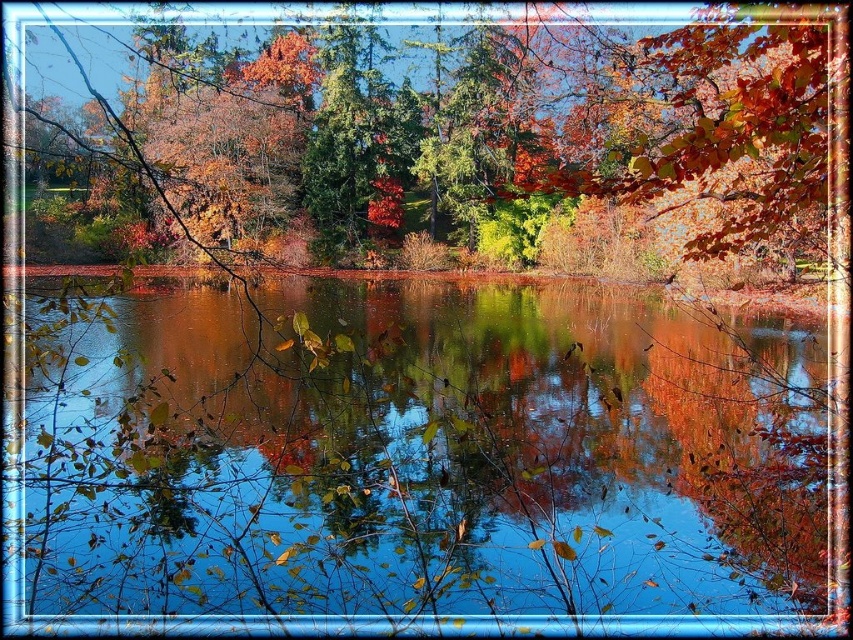
Question: Is transparent water at center to the right of autumn leaves at center from the viewer's perspective?

Choices:
 (A) no
 (B) yes

Answer: (B)

Question: Is transparent water at center positioned before autumn leaves at center?

Choices:
 (A) no
 (B) yes

Answer: (A)

Question: Is transparent water at center above autumn leaves at center?

Choices:
 (A) yes
 (B) no

Answer: (B)